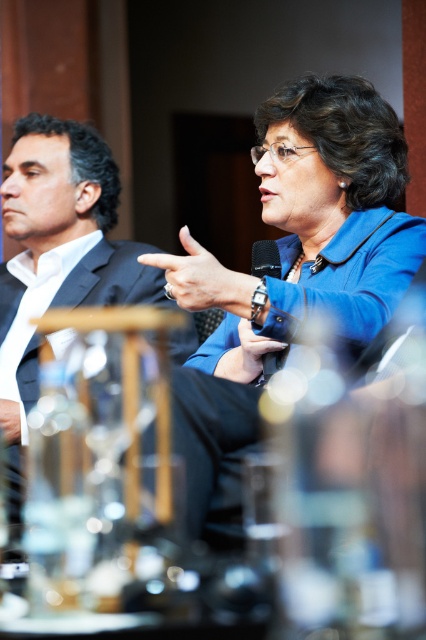
Question: Does blue fabric jacket at center appear on the left side of black suit at left?

Choices:
 (A) yes
 (B) no

Answer: (B)

Question: Based on their relative distances, which object is nearer to the black matte microphone at center?

Choices:
 (A) black suit at left
 (B) blue fabric jacket at center

Answer: (B)

Question: Which is farther from the blue fabric jacket at center?

Choices:
 (A) black suit at left
 (B) black matte microphone at center

Answer: (A)

Question: Among these points, which one is nearest to the camera?

Choices:
 (A) (262, 262)
 (B) (80, 250)

Answer: (A)

Question: Can you confirm if black suit at left is positioned below black matte microphone at center?

Choices:
 (A) no
 (B) yes

Answer: (B)

Question: Can you confirm if blue fabric jacket at center is positioned above black suit at left?

Choices:
 (A) yes
 (B) no

Answer: (A)